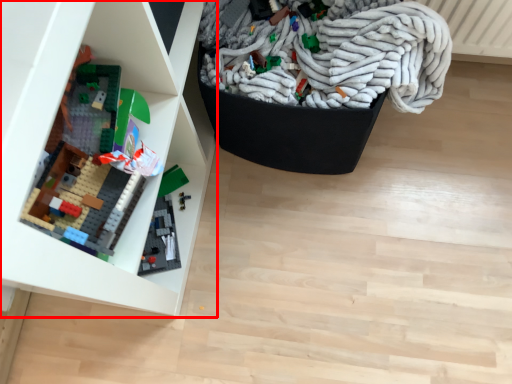
Question: From the image's perspective, where is shelf (annotated by the red box) located relative to wrap?

Choices:
 (A) below
 (B) above

Answer: (A)